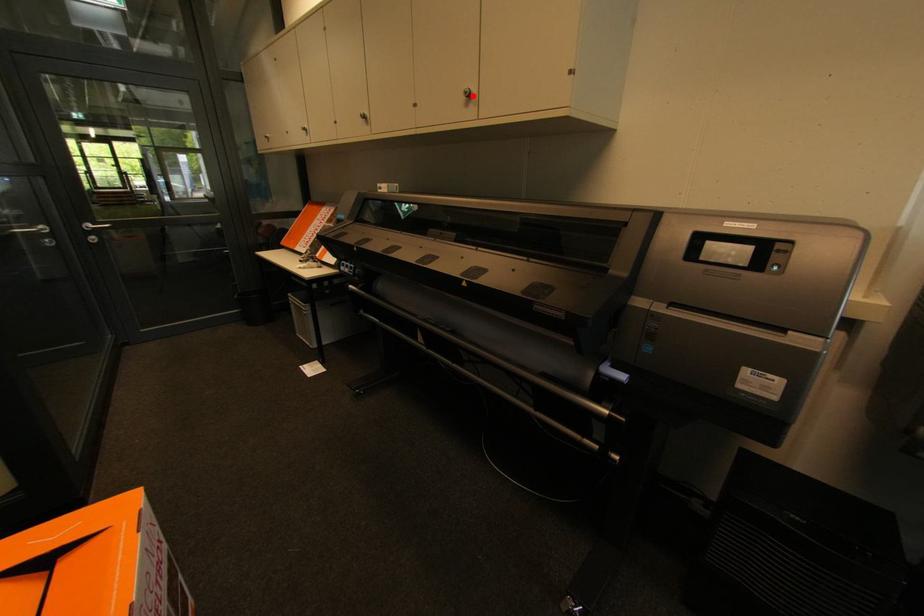
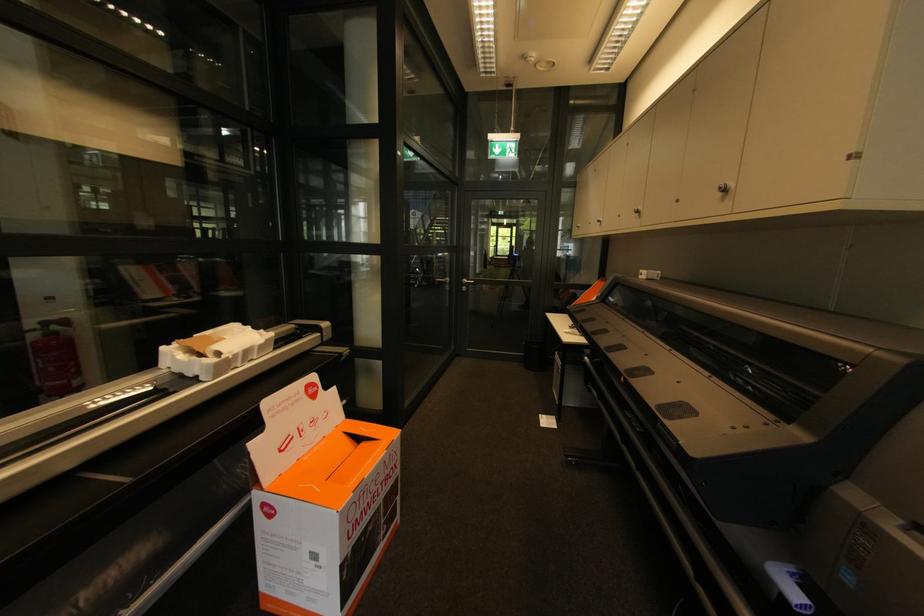
Question: I am providing you with two images of the same scene from different viewpoints. A red point is marked on the first image. Is the red point's position out of view in image 2?

Choices:
 (A) Yes
 (B) No

Answer: (B)